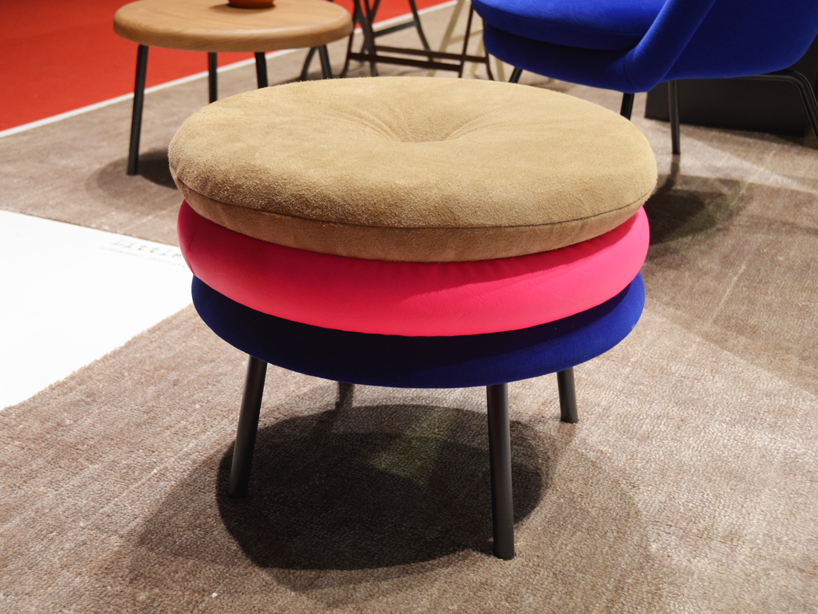
You are a GUI agent. You are given a task and a screenshot of the screen. Output one action in this format:
    pyautogui.click(x=<x>, y=<y>)
    Task: Click on the floor
    This screenshot has height=614, width=818.
    Given the screenshot: What is the action you would take?
    pyautogui.click(x=547, y=280), pyautogui.click(x=129, y=285)